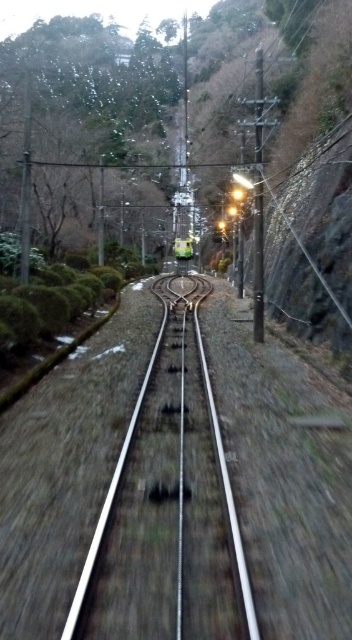
Between metallic silver train track at center and metallic green train at center, which one has more height?

metallic green train at center

Which of these two, metallic silver train track at center or metallic green train at center, stands shorter?

With less height is metallic silver train track at center.

Locate an element on the screen. metallic silver train track at center is located at coordinates [x=168, y=504].